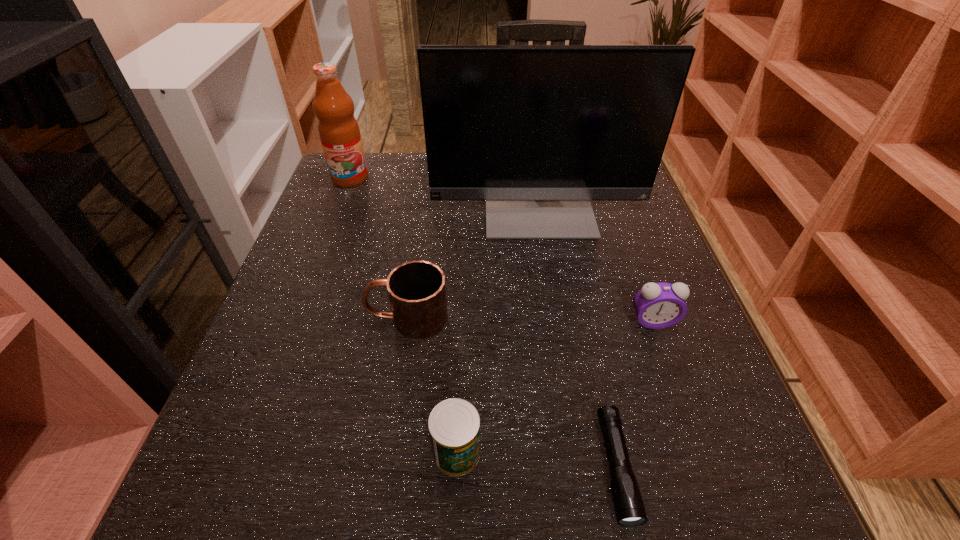
The width and height of the screenshot is (960, 540). Find the location of `the tallest object`. the tallest object is located at coordinates (537, 131).

Where is `the fifth shortest object`? This screenshot has width=960, height=540. the fifth shortest object is located at coordinates (339, 132).

The height and width of the screenshot is (540, 960). What are the coordinates of `the leftmost object` in the screenshot? It's located at (339, 132).

You are a GUI agent. You are given a task and a screenshot of the screen. Output one action in this format:
    pyautogui.click(x=<x>, y=<y>)
    Task: Click on the mug
    Image resolution: width=960 pixels, height=540 pixels.
    Given the screenshot: What is the action you would take?
    pyautogui.click(x=417, y=291)

This screenshot has height=540, width=960. What are the coordinates of `alarm clock` in the screenshot? It's located at (657, 305).

The image size is (960, 540). Find the location of `can`. can is located at coordinates (454, 424).

At what (x,y) coordinates should I click in order to perform the action: click on the shortest object. Please return your answer as a coordinate pair (x, y). This screenshot has width=960, height=540. Looking at the image, I should click on (628, 504).

Identify the location of vacant region located 0.050m on the screen of the tallest object. This screenshot has width=960, height=540. (545, 254).

This screenshot has height=540, width=960. Identify the location of free space located 0.150m on the front label of the second tallest object. (333, 224).

Locate an element on the screen. Image resolution: width=960 pixels, height=540 pixels. vacant space located 0.140m on the side of the mug with the handle is located at coordinates (294, 318).